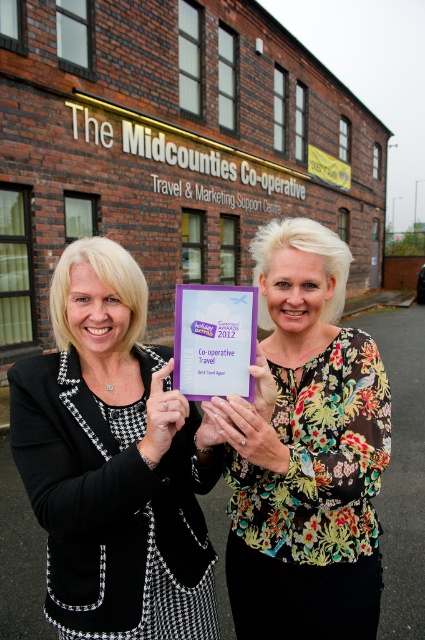
You are a photographer taking a picture of the two women in front of the building. You notice the black houndstooth blazer at center and the purple paper plaque at center. Which object should you focus on if you want to capture the larger one in your shot?

The black houndstooth blazer at center is bigger than the purple paper plaque at center, so you should focus on the black houndstooth blazer at center to capture the larger object in your shot.

You are a photographer trying to capture a clear photo of the floral print blouse at center and the purple paper plaque at center. Which object should you focus on first to ensure both are in focus?

You should focus on the floral print blouse at center first because it is in front of the purple paper plaque at center, so focusing on the closer object will help both be in focus.